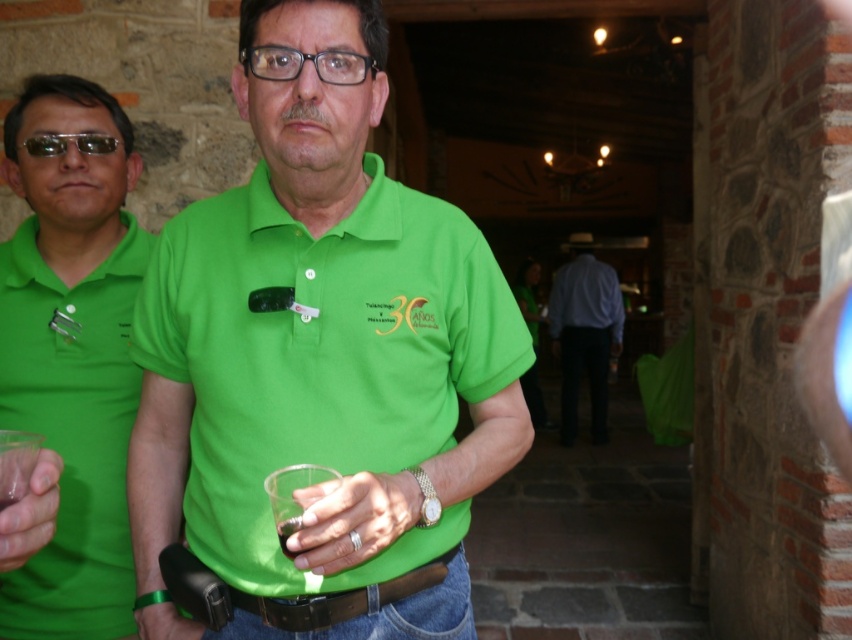
You are standing in the scene and want to move from point (589,380) to point (285,528). Which direction should you move to get closer to your destination?

To move from point (589,380) to point (285,528), you should move downward and to the right since point (285,528) is located lower and further to the right compared to point (589,380).